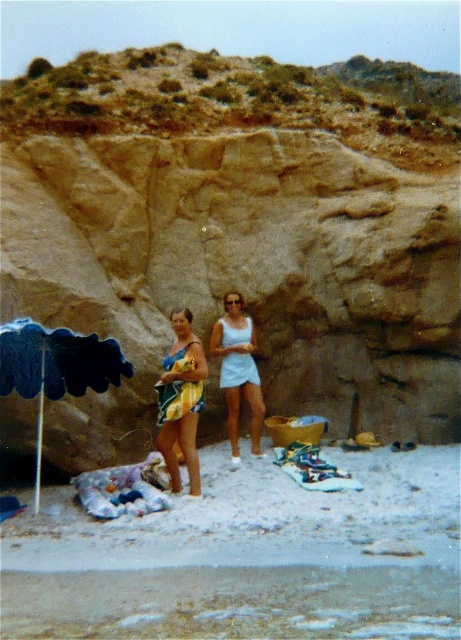
Question: Can you confirm if blue fabric umbrella at left is positioned to the right of yellow striped swimsuit at center?

Choices:
 (A) yes
 (B) no

Answer: (B)

Question: Where is white sand at lower center located in relation to light blue fabric dress at center in the image?

Choices:
 (A) below
 (B) above

Answer: (A)

Question: Which object appears farthest from the camera in this image?

Choices:
 (A) blue fabric umbrella at left
 (B) light blue fabric dress at center
 (C) yellow striped swimsuit at center
 (D) brown rock cliff at center

Answer: (B)

Question: Can you confirm if brown rock cliff at center is thinner than yellow striped swimsuit at center?

Choices:
 (A) yes
 (B) no

Answer: (B)

Question: Which of these objects is positioned closest to the brown rock cliff at center?

Choices:
 (A) white sand at lower center
 (B) yellow striped swimsuit at center
 (C) blue fabric umbrella at left

Answer: (C)

Question: Considering the real-world distances, which object is closest to the yellow striped swimsuit at center?

Choices:
 (A) light blue fabric dress at center
 (B) brown rock cliff at center
 (C) blue fabric umbrella at left
 (D) white sand at lower center

Answer: (C)